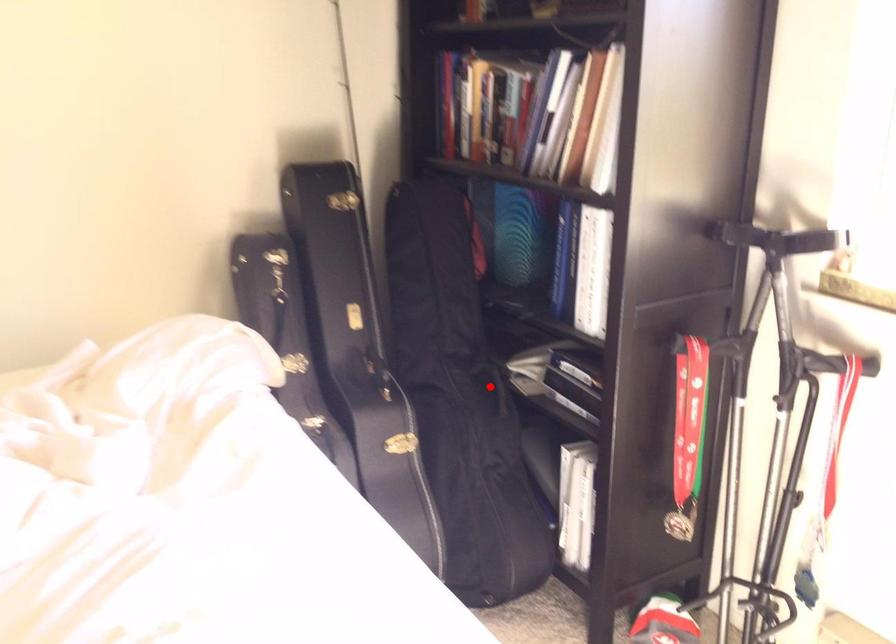
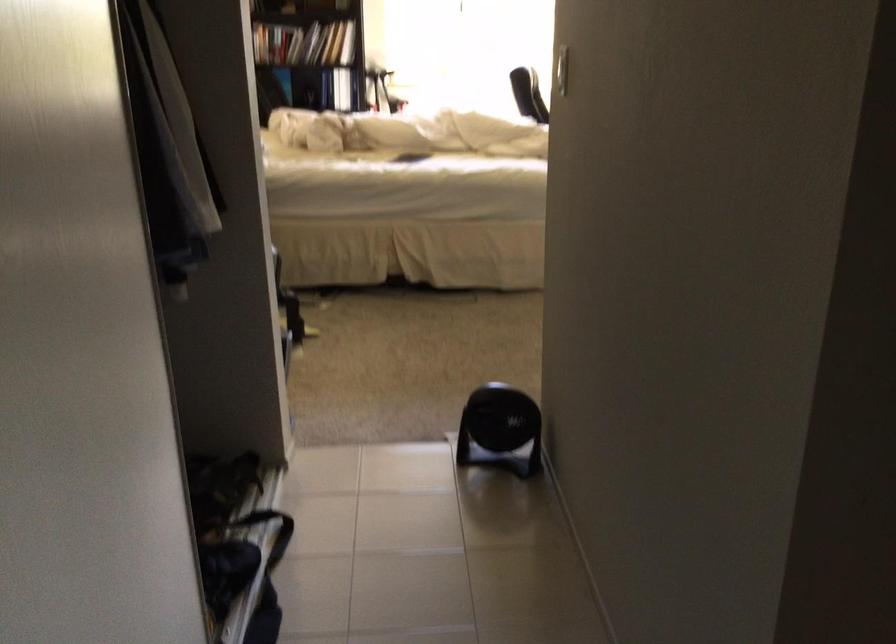
Question: I am providing you with two images of the same scene from different viewpoints. A red point is marked on the first image. Can you still see the location of the red point in image 2?

Choices:
 (A) Yes
 (B) No

Answer: (B)